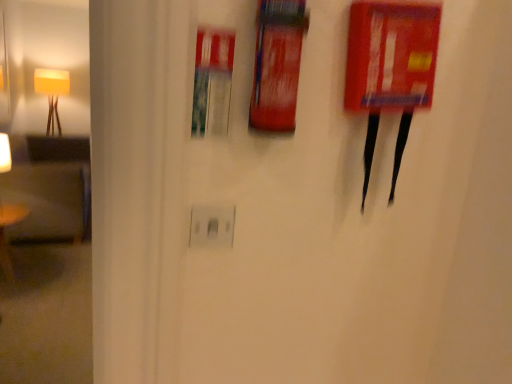
Describe the element at coordinates (52, 94) in the screenshot. The image size is (512, 384). I see `yellow fabric lampshade at left` at that location.

I want to click on wooden table at left, so click(x=5, y=235).

What do you see at coordinates (5, 235) in the screenshot? I see `wooden table at left` at bounding box center [5, 235].

In order to face wooden armchair at left, should I rotate leftwards or rightwards?

Rotate left and turn 25.746 degrees.

In order to click on red plastic fire extinguisher at upper right in this screenshot , I will do `click(390, 67)`.

Identify the location of yellow fabric lampshade at left. (52, 94).

From the image's perspective, is red plastic fire extinguisher at upper right on yellow fabric lampshade at left?

No.

This screenshot has width=512, height=384. What are the coordinates of `lamp on the left of red plastic fire extinguisher at upper right` in the screenshot? It's located at (52, 94).

From the image's perspective, which one is positioned lower, wooden table at left or yellow fabric lampshade at left?

wooden table at left appears lower in the image.

Could you tell me if wooden table at left is facing yellow fabric lampshade at left?

No, wooden table at left is not aimed at yellow fabric lampshade at left.

From the picture: Which object is thinner, wooden table at left or yellow fabric lampshade at left?

wooden table at left is thinner.

Considering the sizes of white plastic electric outlet at center and red plastic fire extinguisher at upper right in the image, is white plastic electric outlet at center wider or thinner than red plastic fire extinguisher at upper right?

white plastic electric outlet at center is thinner than red plastic fire extinguisher at upper right.

Is white plastic electric outlet at center positioned with its back to red plastic fire extinguisher at upper right?

white plastic electric outlet at center does not have its back to red plastic fire extinguisher at upper right.

Is point (227, 219) closer or farther from the camera than point (362, 208)?

Clearly, point (227, 219) is closer to the camera than point (362, 208).

What's the angular difference between white plastic electric outlet at center and red plastic fire extinguisher at upper right's facing directions?

0.122 degrees separate the facing orientations of white plastic electric outlet at center and red plastic fire extinguisher at upper right.

From a real-world perspective, does wooden table at left sit lower than red plastic fire extinguisher at upper right?

Indeed, from a real-world perspective, wooden table at left is positioned beneath red plastic fire extinguisher at upper right.

Is point (10, 275) in front of point (360, 109)?

No, it is not.

In the image, is wooden table at left positioned in front of or behind red plastic fire extinguisher at upper right?

Clearly, wooden table at left is behind red plastic fire extinguisher at upper right.

Which object is wider, white plastic electric outlet at center or yellow fabric lampshade at left?

Wider between the two is yellow fabric lampshade at left.

Is white plastic electric outlet at center looking in the opposite direction of yellow fabric lampshade at left?

Yes.

Can you confirm if white plastic electric outlet at center is taller than yellow fabric lampshade at left?

Incorrect, the height of white plastic electric outlet at center is not larger of that of yellow fabric lampshade at left.

Which of these two, white plastic electric outlet at center or yellow fabric lampshade at left, is bigger?

With larger size is yellow fabric lampshade at left.

Considering the relative positions of wooden armchair at left and wooden table at left in the image provided, is wooden armchair at left behind wooden table at left?

Yes, it is.

Is wooden armchair at left next to wooden table at left?

There is a gap between wooden armchair at left and wooden table at left.

At what (x,y) coordinates should I click in order to perform the action: click on armchair lying behind the wooden table at left. Please return your answer as a coordinate pair (x, y). Looking at the image, I should click on (50, 189).

From a real-world perspective, does wooden table at left stand above wooden armchair at left?

No, from a real-world perspective, wooden table at left is not over wooden armchair at left

Looking at this image, which of these two, wooden table at left or wooden armchair at left, stands taller?

With more height is wooden armchair at left.

Considering the sizes of objects wooden table at left and wooden armchair at left in the image provided, who is bigger, wooden table at left or wooden armchair at left?

wooden armchair at left.

From the image's perspective, is wooden table at left on top of wooden armchair at left?

No, from the image's perspective, wooden table at left is not above wooden armchair at left.

Find the location of `lamp located underneath the red plastic fire extinguisher at upper right (from a real-world perspective)`. lamp located underneath the red plastic fire extinguisher at upper right (from a real-world perspective) is located at coordinates (52, 94).

The image size is (512, 384). Find the location of `lamp located above the wooden table at left (from the image's perspective)`. lamp located above the wooden table at left (from the image's perspective) is located at coordinates (52, 94).

From the image, which object appears to be nearer to wooden armchair at left, white plastic electric outlet at center or red matte fire extinguisher at upper center?

Based on the image, white plastic electric outlet at center appears to be nearer to wooden armchair at left.

Based on their spatial positions, is wooden table at left or yellow fabric lampshade at left closer to red matte fire extinguisher at upper center?

wooden table at left is closer to red matte fire extinguisher at upper center.

Considering their positions, is white plastic electric outlet at center positioned further to red matte fire extinguisher at upper center than red plastic fire extinguisher at upper right?

white plastic electric outlet at center lies further to red matte fire extinguisher at upper center than the other object.

Estimate the real-world distances between objects in this image. Which object is closer to wooden table at left, wooden armchair at left or red plastic fire extinguisher at upper right?

wooden armchair at left is closer to wooden table at left.

Considering their positions, is wooden armchair at left positioned closer to red plastic fire extinguisher at upper right than white plastic electric outlet at center?

white plastic electric outlet at center.

Consider the image. Based on their spatial positions, is wooden table at left or red plastic fire extinguisher at upper right closer to yellow fabric lampshade at left?

wooden table at left is closer to yellow fabric lampshade at left.

Estimate the real-world distances between objects in this image. Which object is further from yellow fabric lampshade at left, red matte fire extinguisher at upper center or wooden table at left?

Based on the image, red matte fire extinguisher at upper center appears to be further to yellow fabric lampshade at left.

From the image, which object appears to be nearer to wooden table at left, wooden armchair at left or yellow fabric lampshade at left?

The object closer to wooden table at left is wooden armchair at left.

At what (x,y) coordinates should I click in order to perform the action: click on furniture between white plastic electric outlet at center and wooden armchair at left from front to back. Please return your answer as a coordinate pair (x, y). The image size is (512, 384). Looking at the image, I should click on (5, 235).

Identify the location of furniture between red plastic fire extinguisher at upper right and yellow fabric lampshade at left along the z-axis. The width and height of the screenshot is (512, 384). (5, 235).

Identify the location of extinguisher between white plastic electric outlet at center and red plastic fire extinguisher at upper right from left to right. (277, 64).

Find the location of a particular element. Image resolution: width=512 pixels, height=384 pixels. armchair between red matte fire extinguisher at upper center and yellow fabric lampshade at left in the front-back direction is located at coordinates (50, 189).